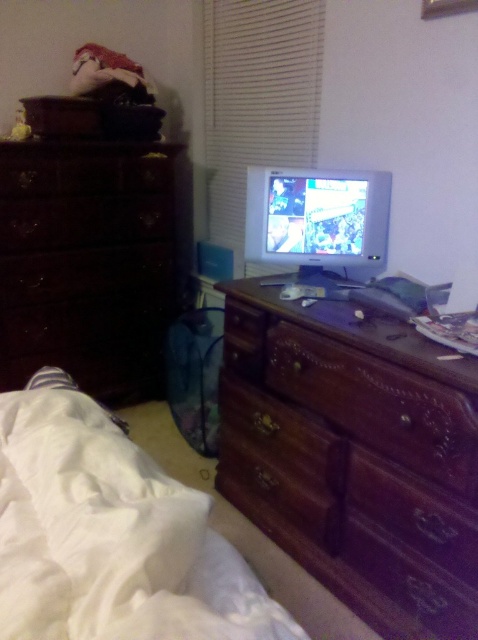
You are trying to find a place to put a new bookshelf in the room. The bookshelf is 1.2 meters tall. You see the white matte blinds at upper center and the wooden drawer at center. Can you place the bookshelf between them vertically?

The white matte blinds at upper center is located above the wooden drawer at center, so there is space between them vertically. Since the bookshelf is 1.2 meters tall, you need to ensure the vertical distance between the white matte blinds at upper center and the wooden drawer at center is at least 1.2 meters. However, the description does not provide specific measurements of the distance between them, so it is uncertain if the space is sufficient.

You are standing in the room and want to locate the white matte blinds at upper center. Which object from the following list is closest to the point marked as point (x=257, y=99)? The options are the dark finish dresser on the left, the lighter wooden dresser on the right, or the blue laundry basket near the left dresser.

The point (x=257, y=99) corresponds to the white matte blinds at upper center, which is closest to the upper center area of the room. Among the options provided, the closest object would be the lighter wooden dresser on the right since it is positioned on the right side, but the exact proximity cannot be determined without spatial coordinates. However, according to the description, the point directly corresponds to the blinds, so none of the listed objects are at that point. The answer might need rephrasing.